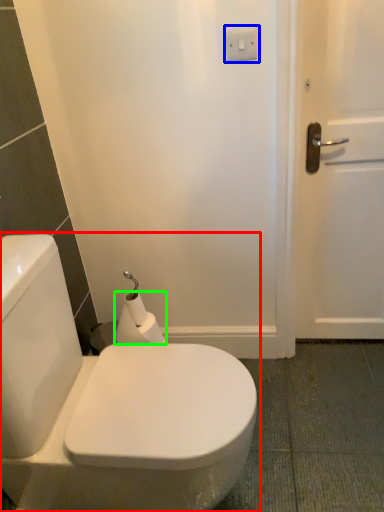
Question: Based on their relative distances, which object is farther from toilet (highlighted by a red box)? Choose from electric outlet (highlighted by a blue box) and toilet paper (highlighted by a green box).

Choices:
 (A) electric outlet
 (B) toilet paper

Answer: (A)